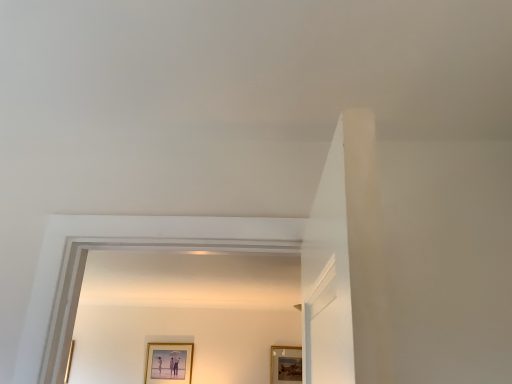
Image resolution: width=512 pixels, height=384 pixels. I want to click on matte gold picture frame at lower center, so click(x=169, y=363).

What do you see at coordinates (169, 363) in the screenshot? This screenshot has width=512, height=384. I see `matte gold picture frame at lower center` at bounding box center [169, 363].

In order to face matte gold picture frame at lower center, should I rotate leftwards or rightwards?

Turn left approximately 11.260 degrees to face it.

Find the location of a particular element. This screenshot has height=384, width=512. matte gold picture frame at lower center is located at coordinates (169, 363).